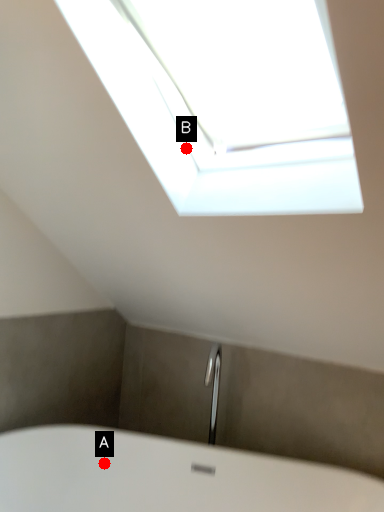
Question: Two points are circled on the image, labeled by A and B beside each circle. Which point is closer to the camera?

Choices:
 (A) A is closer
 (B) B is closer

Answer: (B)